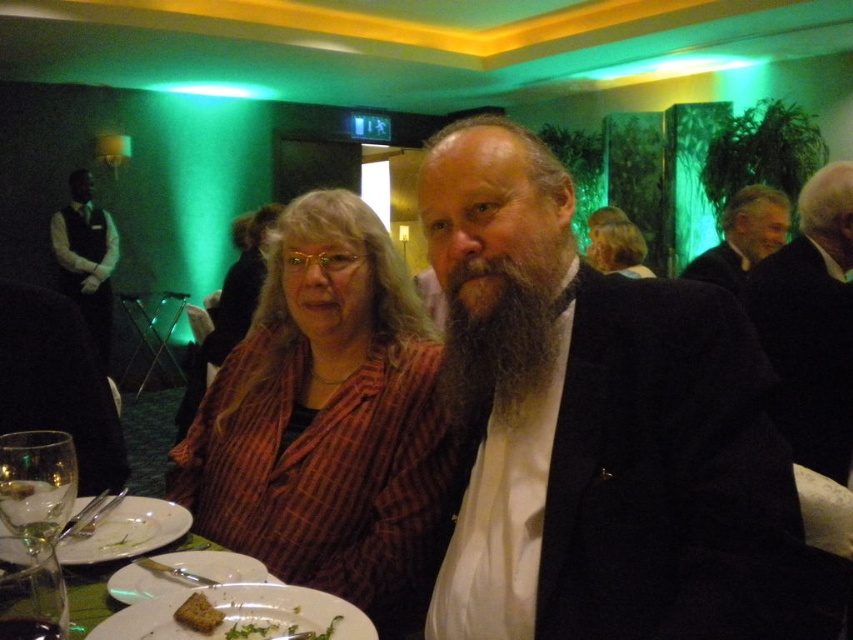
Where is `plaid fabric shirt at center`? The width and height of the screenshot is (853, 640). plaid fabric shirt at center is located at coordinates (329, 422).

Does plaid fabric shirt at center appear on the right side of white porcelain plate at center?

Indeed, plaid fabric shirt at center is positioned on the right side of white porcelain plate at center.

Is point (416, 502) closer to camera compared to point (144, 525)?

That is False.

Where is `plaid fabric shirt at center`? This screenshot has height=640, width=853. plaid fabric shirt at center is located at coordinates (329, 422).

Which is behind, point (292, 598) or point (198, 605)?

The point (292, 598) is behind.

Is white porcelain plates at center bigger than crusty bread at lower center?

Correct, white porcelain plates at center is larger in size than crusty bread at lower center.

Between point (338, 620) and point (196, 621), which one is positioned in front?

Point (196, 621) is in front.

Where is `white porcelain plates at center`? This screenshot has height=640, width=853. white porcelain plates at center is located at coordinates (239, 612).

Is black wool suit at right taller than white matte plate at center?

Indeed, black wool suit at right has a greater height compared to white matte plate at center.

Who is lower down, black wool suit at right or white matte plate at center?

white matte plate at center is below.

Based on the photo, who is more distant from viewer, (820,337) or (260,611)?

The point (820,337) is behind.

Where is `black wool suit at right`? black wool suit at right is located at coordinates (811, 323).